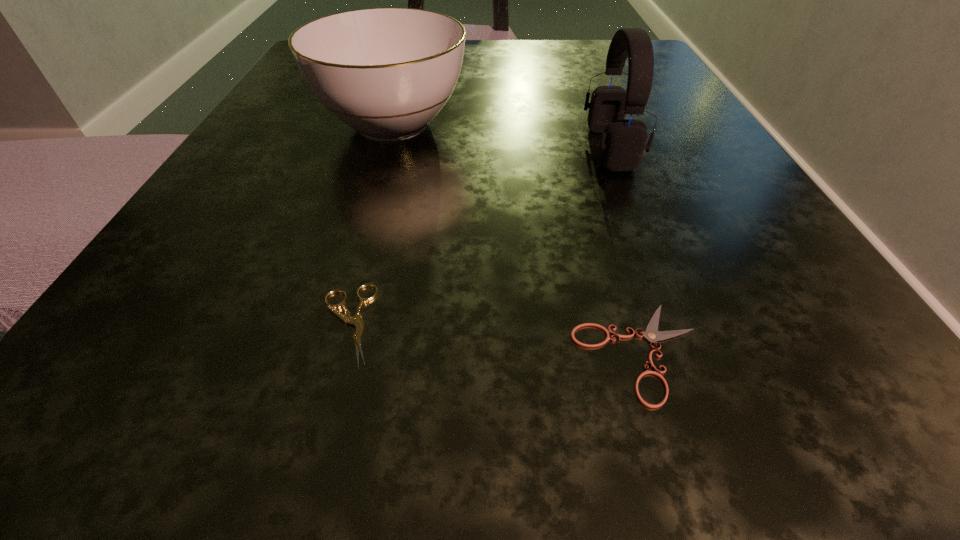
I want to click on vacant space at the left edge, so click(x=314, y=170).

Locate an element on the screen. vacant space at the right edge of the desktop is located at coordinates (655, 260).

Locate an element on the screen. The height and width of the screenshot is (540, 960). vacant space at the near left corner of the desktop is located at coordinates (221, 429).

Where is `vacant space at the far right corner of the desktop`? The width and height of the screenshot is (960, 540). vacant space at the far right corner of the desktop is located at coordinates (616, 76).

In the image, there is a desktop. Where is `vacant space at the near right corner`? vacant space at the near right corner is located at coordinates (797, 447).

What are the coordinates of `free space between the second shortest object and the shorter shears` in the screenshot? It's located at (492, 338).

Identify the location of free space between the shorter shears and the chinaware. (516, 238).

Identify the location of empty space between the shorter shears and the left shears. (492, 338).

The width and height of the screenshot is (960, 540). Identify the location of free space between the tallest object and the shortest object. (624, 250).

You are a GUI agent. You are given a task and a screenshot of the screen. Output one action in this format:
    pyautogui.click(x=<x>, y=<y>)
    Task: Click on the vacant region between the left shears and the shortest object
    The height and width of the screenshot is (540, 960).
    Given the screenshot: What is the action you would take?
    pyautogui.click(x=492, y=338)